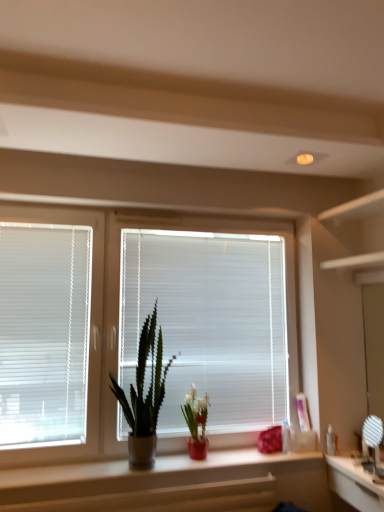
Find the location of a particular element. This screenshot has height=512, width=384. vacant space situated on the left part of matte red vase at center, which is counted as the second houseplant, starting from the left is located at coordinates (166, 463).